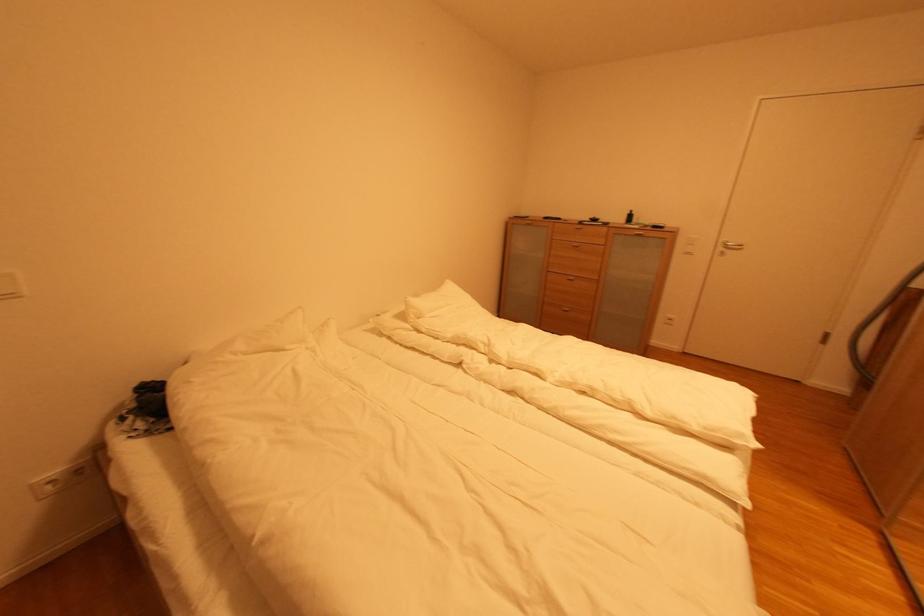
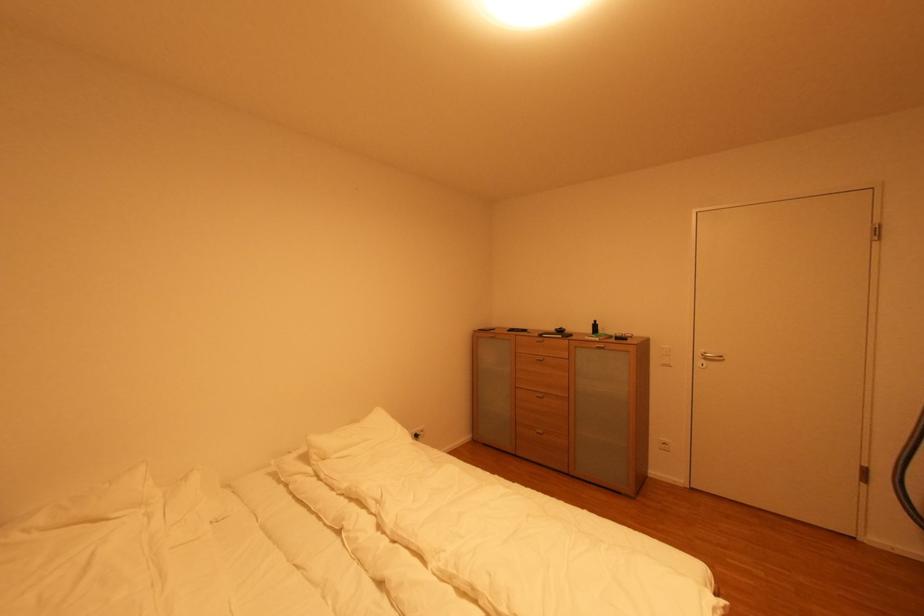
Question: I am providing you with two images of the same scene from different viewpoints. After the viewpoint changes to image2, which objects are now occluded?

Choices:
 (A) white pillow
 (B) small dark bottle
 (C) black remote control
 (D) none of these

Answer: (D)